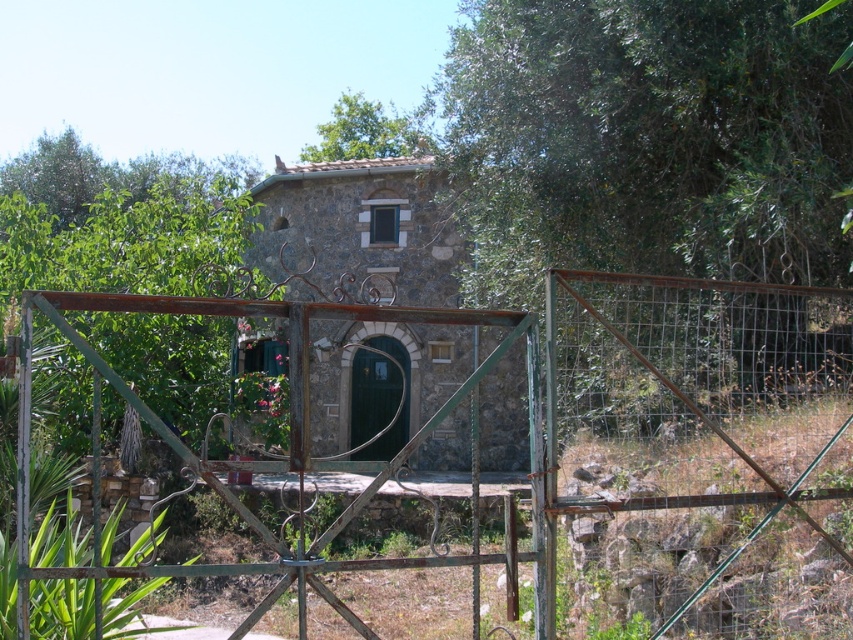
You are standing in front of the rustic stone house and see the point marked at coordinates (x=554, y=410). What object is located at that point?

The point at coordinates (x=554, y=410) indicates the rusty metal gate at center.

You are a visitor approaching the house and want to enter. You see the rusty metal gate at center and the green matte door at center. Which object should you interact with first to enter the house?

You should interact with the rusty metal gate at center first since it is closer to you than the green matte door at center.

Based on the photo, you are standing in front of a rustic stone house with a metal gate. The gate is at the center of your view. If you want to walk towards the rusty metal gate at center, how many steps would you need to take if each step is about 0.75 meters?

The rusty metal gate at center is 5.07 meters away. Since each step is 0.75 meters, dividing 5.07 by 0.75 gives approximately 6.76 steps. Therefore, you would need to take about 7 steps to reach the rusty metal gate at center.